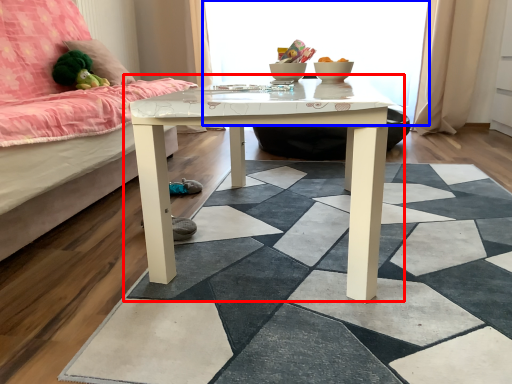
Question: Which of the following is the closest to the observer, table (highlighted by a red box) or window screen (highlighted by a blue box)?

Choices:
 (A) table
 (B) window screen

Answer: (A)